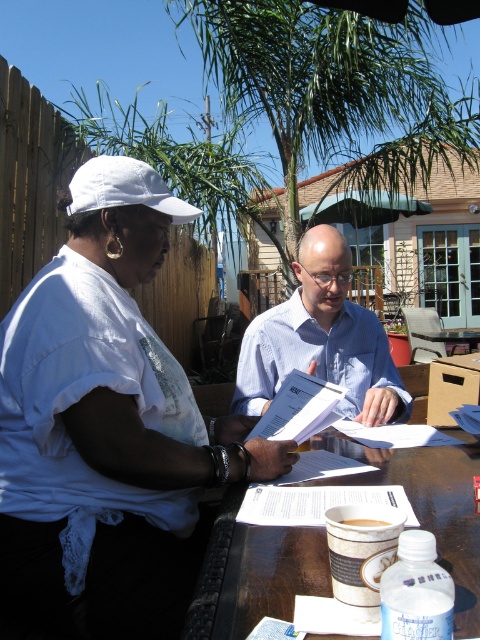
You are a delivery person who needs to place a 12 inch long package between the white fabric baseball cap at upper left and the brown matte cup at center. Can the package fit in the space between them?

The distance between the white fabric baseball cap at upper left and the brown matte cup at center is 39.25 inches. Since the package is 12 inches long, it can easily fit within that space.

You are a photographer taking a picture of the two people at the table. You want to ensure both the white cotton shirt at upper left and the blue shirt at center are clearly visible in the frame. Based on their positions, which shirt should you focus on first to capture both in the shot?

The white cotton shirt at upper left is to the left of the blue shirt at center, so focusing on the white cotton shirt at upper left first would allow you to adjust the frame to include both shirts since they are positioned side by side.

In the scene shown: You are a photographer taking a picture of the scene. You want to ensure that both the white fabric baseball cap at upper left and the brown matte cup at center are clearly visible in the photo. Based on their positions, will you need to adjust the camera angle to capture both objects without one blocking the other?

The brown matte cup at center is behind the white fabric baseball cap at upper left, so adjusting the camera angle might be necessary to avoid the cap blocking the cup in the photo.